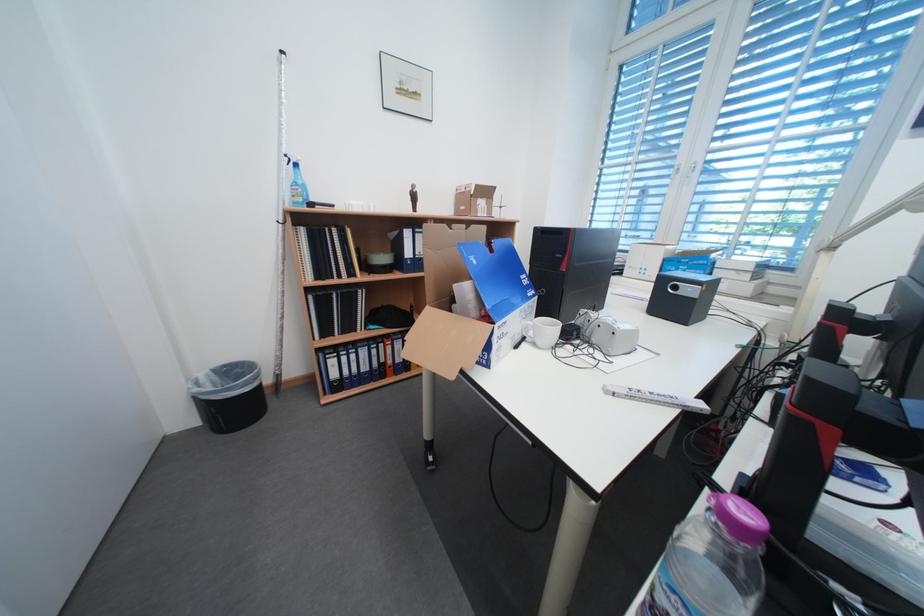
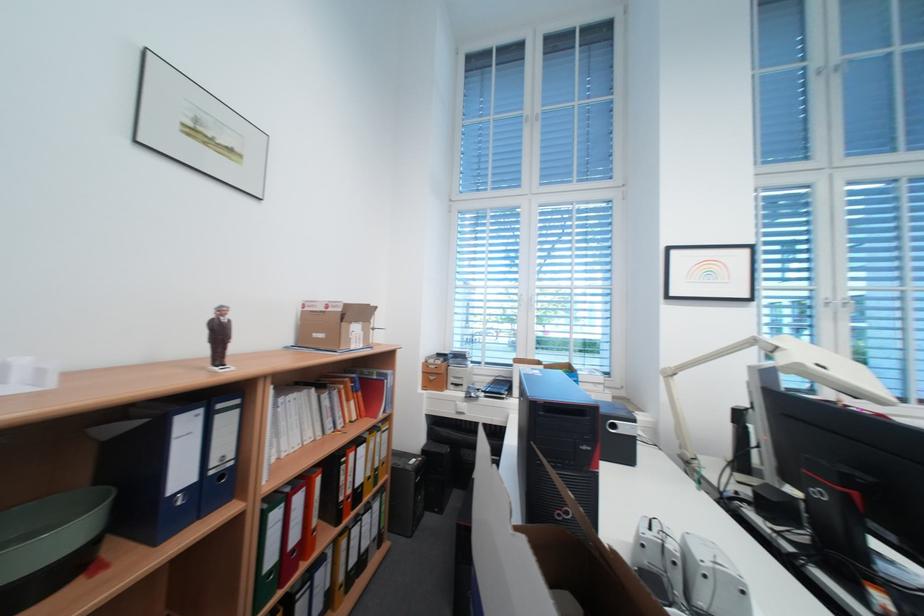
First-person continuous shooting, in which direction is the camera rotating?

The camera's rotation is toward right-up.